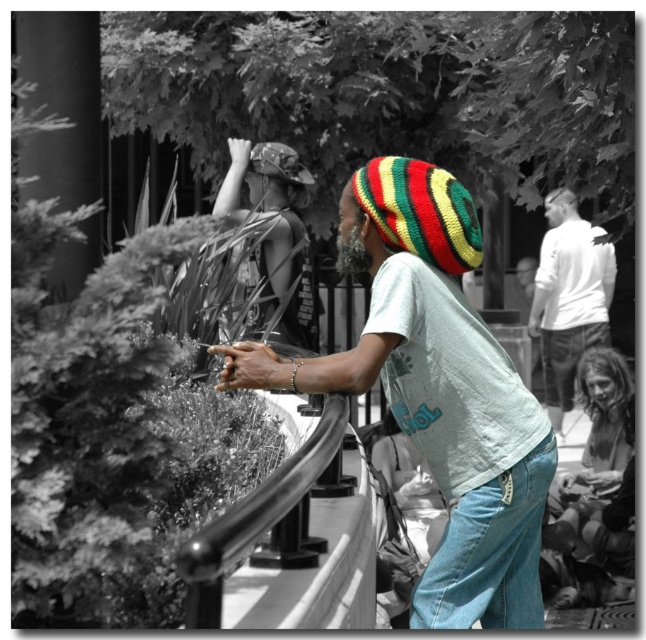
Question: Is knitted multicolored hat at center further to the viewer compared to white cotton shirt at upper right?

Choices:
 (A) yes
 (B) no

Answer: (B)

Question: Is knitted multicolored hat at center to the left of white cotton shirt at upper right from the viewer's perspective?

Choices:
 (A) no
 (B) yes

Answer: (B)

Question: Does knitted multicolored hat at center lie in front of white cotton shirt at upper right?

Choices:
 (A) yes
 (B) no

Answer: (A)

Question: Which of the following is the farthest from the observer?

Choices:
 (A) (596, 266)
 (B) (401, 401)

Answer: (A)